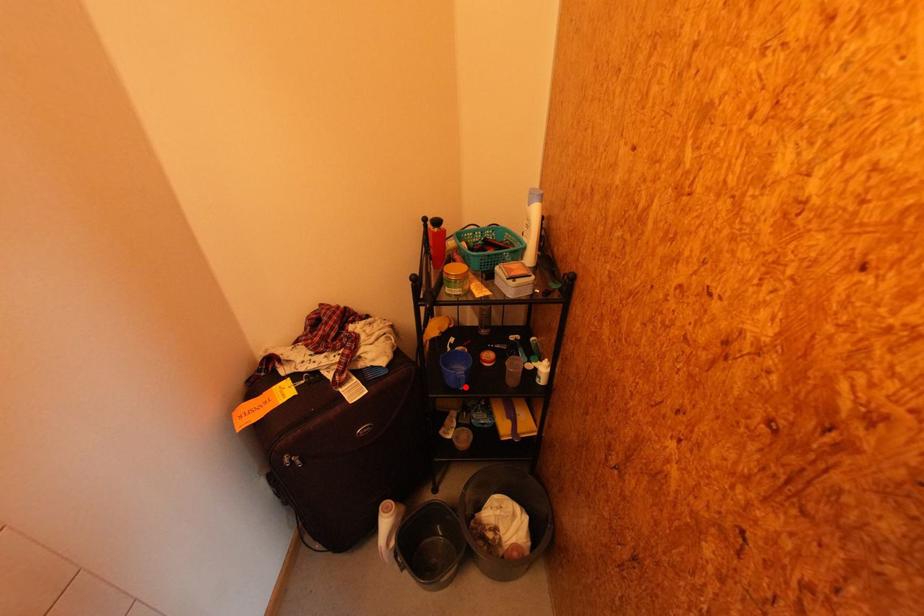
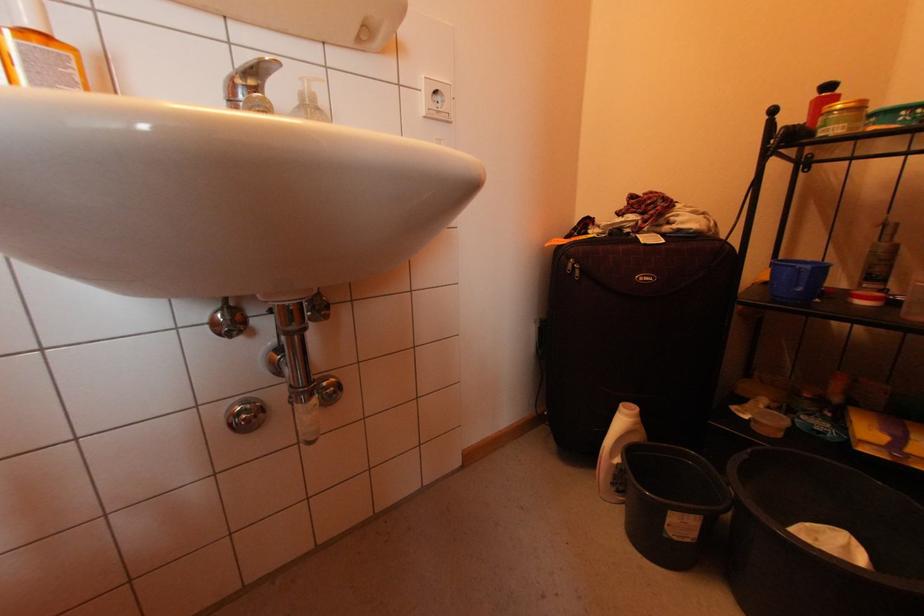
Where in the second image is the point corresponding to the highlighted location from the first image?

(803, 286)